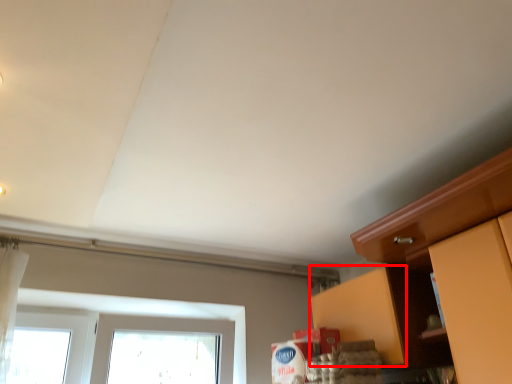
Question: From the image's perspective, where is cabinetry (annotated by the red box) located in relation to cabinetry in the image?

Choices:
 (A) below
 (B) above

Answer: (A)